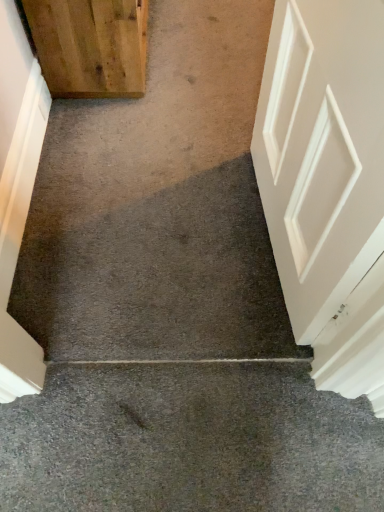
Question: Looking at their shapes, would you say white matte door at left, the second door in the top-to-bottom sequence, is wider or thinner than wooden door at upper left, the second door positioned from the bottom?

Choices:
 (A) wide
 (B) thin

Answer: (B)

Question: Is white matte door at left, positioned as the first door in bottom-to-top order, spatially inside wooden door at upper left, the second door positioned from the bottom, or outside of it?

Choices:
 (A) outside
 (B) inside

Answer: (A)

Question: Based on their relative distances, which object is farther from the white matte door at left, the second door in the top-to-bottom sequence?

Choices:
 (A) wooden door at upper left, the second door positioned from the bottom
 (B) gray carpet at center

Answer: (B)

Question: Based on their relative distances, which object is farther from the gray carpet at center?

Choices:
 (A) white matte door at left, positioned as the first door in bottom-to-top order
 (B) wooden door at upper left, which appears as the first door when viewed from the top

Answer: (B)